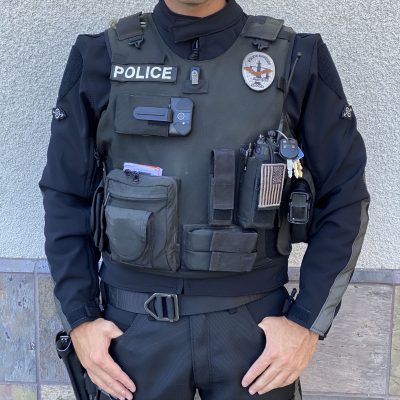
This screenshot has width=400, height=400. Identify the location of phone holder. (144, 114), (129, 116).